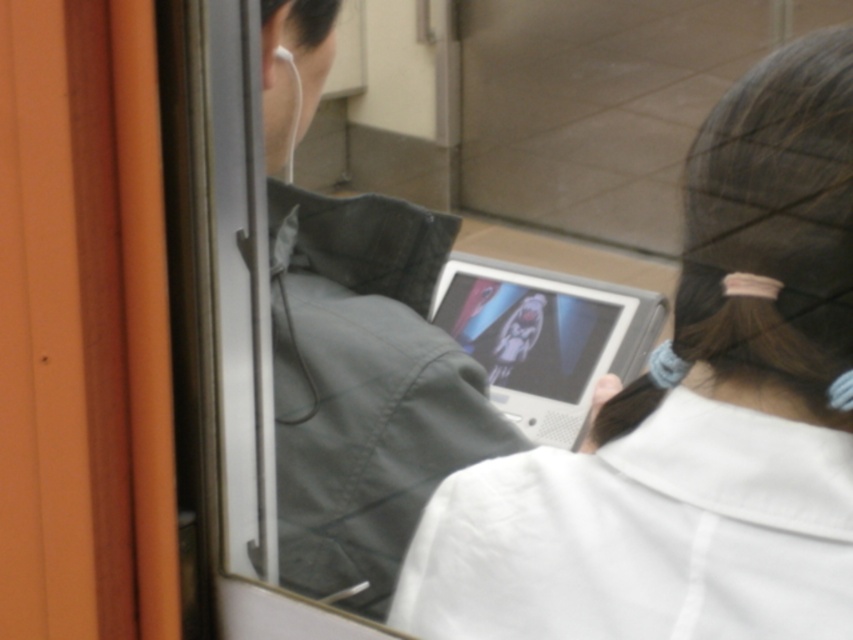
Does white matte laptop at center have a larger size compared to white matte earphone at upper left?

Yes, white matte laptop at center is bigger than white matte earphone at upper left.

Is white matte laptop at center below white matte earphone at upper left?

Yes, white matte laptop at center is below white matte earphone at upper left.

Does point (810, 636) come in front of point (287, 166)?

Yes, point (810, 636) is closer to viewer.

I want to click on white matte laptop at center, so click(x=692, y=417).

Can you confirm if dark gray fabric jacket at center is shorter than silver metallic tablet at center?

No, dark gray fabric jacket at center is not shorter than silver metallic tablet at center.

Does dark gray fabric jacket at center have a larger size compared to silver metallic tablet at center?

Correct, dark gray fabric jacket at center is larger in size than silver metallic tablet at center.

The width and height of the screenshot is (853, 640). Identify the location of dark gray fabric jacket at center. (368, 420).

Does white matte laptop at center come behind dark gray fabric jacket at center?

No, white matte laptop at center is in front of dark gray fabric jacket at center.

Can you confirm if white matte laptop at center is positioned to the right of dark gray fabric jacket at center?

Indeed, white matte laptop at center is positioned on the right side of dark gray fabric jacket at center.

Find the location of a particular element. white matte laptop at center is located at coordinates (692, 417).

This screenshot has width=853, height=640. Identify the location of white matte laptop at center. (692, 417).